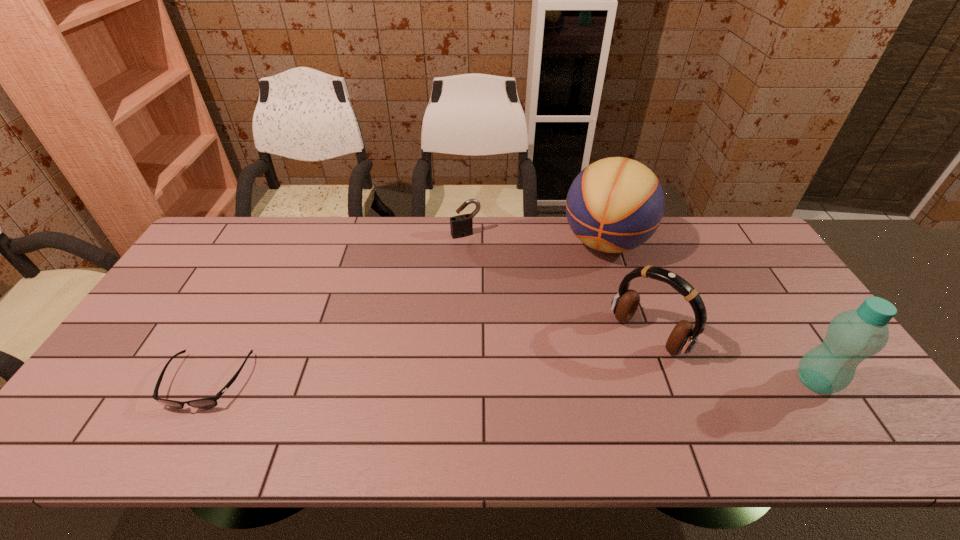
The width and height of the screenshot is (960, 540). Identify the location of the shortest object. (205, 403).

This screenshot has height=540, width=960. Identify the location of the leftmost object. (205, 403).

This screenshot has width=960, height=540. What are the coordinates of `bottle` in the screenshot? It's located at (852, 336).

Find the location of a particular element. the second object from left to right is located at coordinates (461, 226).

Where is `padlock`? This screenshot has width=960, height=540. padlock is located at coordinates (461, 226).

Locate an element on the screen. This screenshot has width=960, height=540. headset is located at coordinates (683, 338).

I want to click on basketball, so click(x=614, y=205).

The height and width of the screenshot is (540, 960). In order to click on vacant space located 0.190m on the left of the rightmost object in this screenshot , I will do `click(720, 381)`.

I want to click on vacant region located with the keyhole on the front of the fourth tallest object, so click(492, 280).

Locate an element on the screen. The width and height of the screenshot is (960, 540). vacant space located with the keyhole on the front of the fourth tallest object is located at coordinates tap(515, 321).